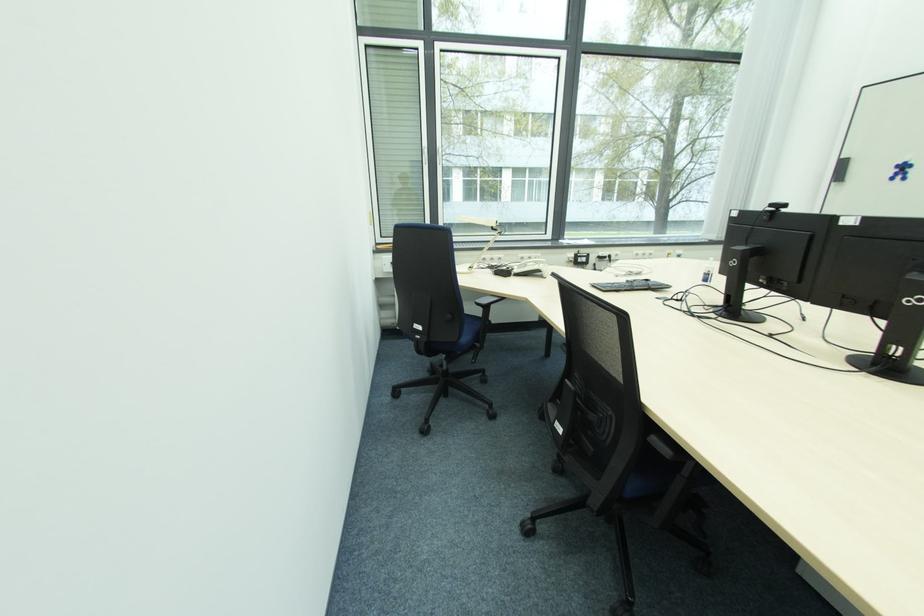
Locate an element on the screen. sanitizer bottle pump is located at coordinates (708, 270).